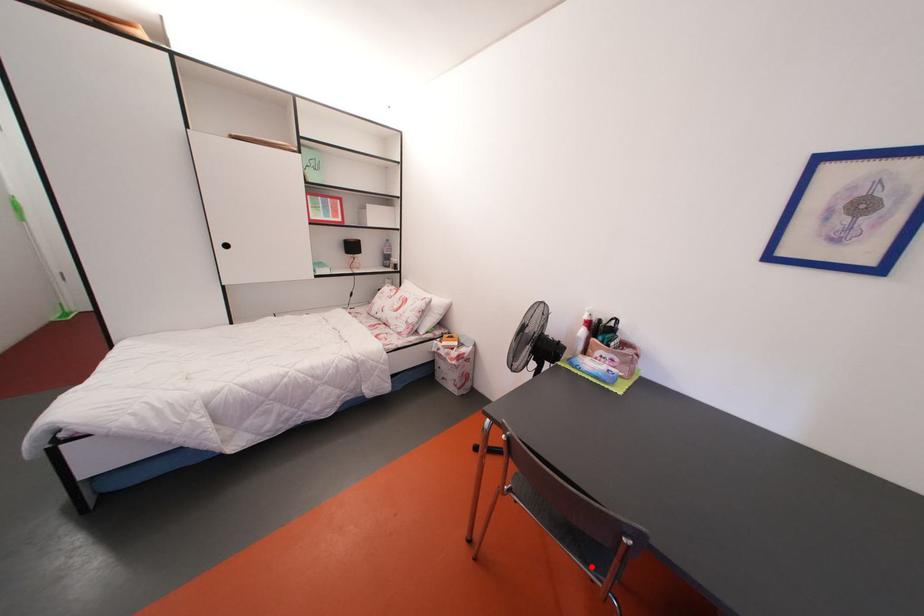
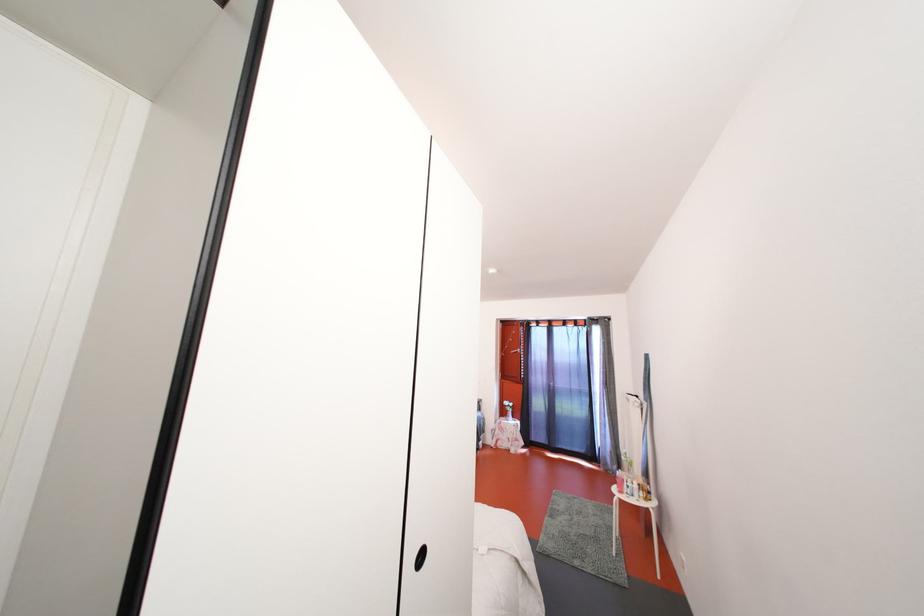
Question: I am providing you with two images of the same scene from different viewpoints. A red point is marked on the first image. Can you still see the location of the red point in image 2?

Choices:
 (A) Yes
 (B) No

Answer: (B)